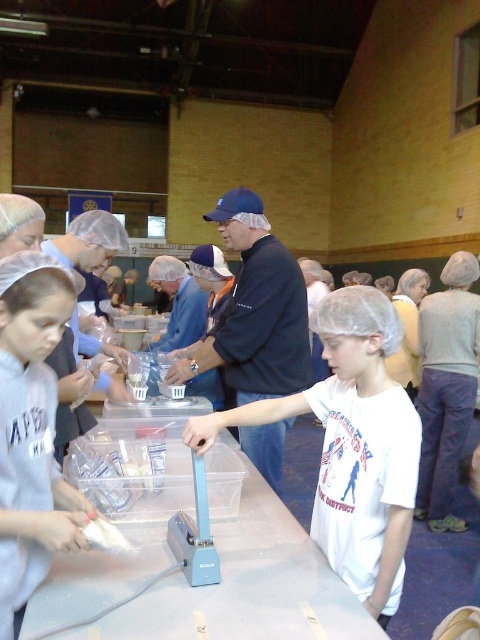
You are organizing a food packaging event in a gymnasium. You have a clear plastic table at center and a dark blue cap at center. Which object is taller?

The dark blue cap at center is taller than the clear plastic table at center.

You are standing in front of the table and want to place a new container at the point closer to you. Which point should you choose between point (27,342) and point (256,196)?

Point (27,342) is closer to the camera than point (256,196), so you should choose point (27,342) to place the new container.

You are organizing a food packaging event in a gymnasium. You have a clear plastic table at center and a blue fabric shirt at center. Which object is smaller in size?

The clear plastic table at center is smaller in size compared to the blue fabric shirt at center.